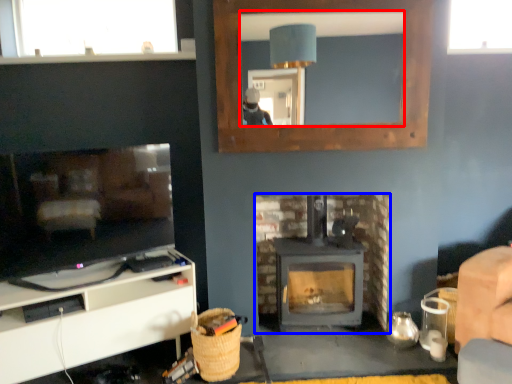
Question: Which point is further to the camera, mirror (highlighted by a red box) or fireplace (highlighted by a blue box)?

Choices:
 (A) mirror
 (B) fireplace

Answer: (B)